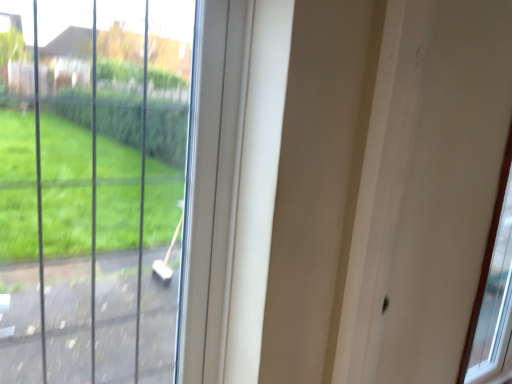
I want to click on transparent glass window at left, so click(x=92, y=187).

What is the approximate height of transparent glass window at left?

It is 3.97 feet.

Describe the element at coordinates (92, 187) in the screenshot. I see `transparent glass window at left` at that location.

I want to click on transparent glass window at left, so click(92, 187).